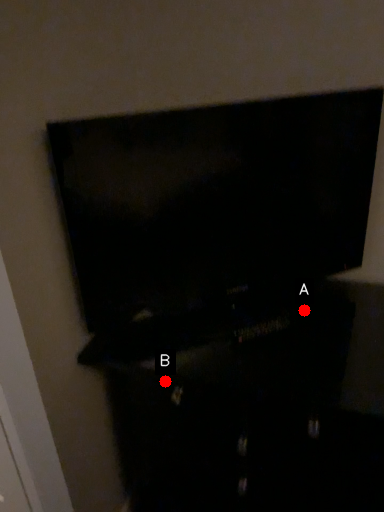
Question: Two points are circled on the image, labeled by A and B beside each circle. Which point is closer to the camera?

Choices:
 (A) A is closer
 (B) B is closer

Answer: (B)